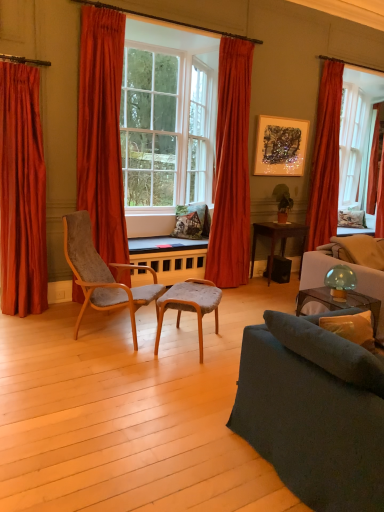
Question: Which direction should I rotate to look at wooden table at center, positioned as the first table in left-to-right order?

Choices:
 (A) right
 (B) left

Answer: (B)

Question: Is velvet orange curtain at right, which ranks as the second curtain in right-to-left order, thinner than velvet grey chair at center, marked as the 1th chair in a right-to-left arrangement?

Choices:
 (A) yes
 (B) no

Answer: (A)

Question: Is velvet orange curtain at right, which ranks as the second curtain in right-to-left order, positioned behind velvet grey chair at center, marked as the 1th chair in a right-to-left arrangement?

Choices:
 (A) no
 (B) yes

Answer: (B)

Question: From a real-world perspective, is velvet orange curtain at right, placed as the fourth curtain when sorted from left to right, physically above velvet grey chair at center, marked as the 1th chair in a right-to-left arrangement?

Choices:
 (A) yes
 (B) no

Answer: (A)

Question: Can we say velvet orange curtain at right, which ranks as the second curtain in right-to-left order, lies outside velvet grey chair at center, marked as the 1th chair in a right-to-left arrangement?

Choices:
 (A) no
 (B) yes

Answer: (B)

Question: From the image's perspective, is velvet orange curtain at right, placed as the fourth curtain when sorted from left to right, under velvet grey chair at center, marked as the 1th chair in a right-to-left arrangement?

Choices:
 (A) yes
 (B) no

Answer: (B)

Question: Is velvet orange curtain at right, which ranks as the second curtain in right-to-left order, far away from velvet grey chair at center, which is the 2th chair from left to right?

Choices:
 (A) yes
 (B) no

Answer: (A)

Question: Can you confirm if velvet grey chair at center, marked as the 1th chair in a right-to-left arrangement, is wider than translucent glass mushroom at upper right?

Choices:
 (A) yes
 (B) no

Answer: (A)

Question: Considering the relative positions of velvet grey chair at center, which is the 2th chair from left to right, and translucent glass mushroom at upper right in the image provided, is velvet grey chair at center, which is the 2th chair from left to right, in front of translucent glass mushroom at upper right?

Choices:
 (A) yes
 (B) no

Answer: (A)

Question: Considering the relative positions of velvet grey chair at center, which is the 2th chair from left to right, and translucent glass mushroom at upper right in the image provided, is velvet grey chair at center, which is the 2th chair from left to right, behind translucent glass mushroom at upper right?

Choices:
 (A) yes
 (B) no

Answer: (B)

Question: Is velvet grey chair at center, marked as the 1th chair in a right-to-left arrangement, with translucent glass mushroom at upper right?

Choices:
 (A) yes
 (B) no

Answer: (B)

Question: Does velvet grey chair at center, which is the 2th chair from left to right, have a lesser width compared to translucent glass mushroom at upper right?

Choices:
 (A) yes
 (B) no

Answer: (B)

Question: From a real-world perspective, is velvet grey chair at center, marked as the 1th chair in a right-to-left arrangement, beneath translucent glass mushroom at upper right?

Choices:
 (A) no
 (B) yes

Answer: (B)

Question: Can you confirm if velvet orange curtain at left, the 4th curtain when ordered from right to left, is positioned to the left of metallic textured artwork at upper center?

Choices:
 (A) yes
 (B) no

Answer: (A)